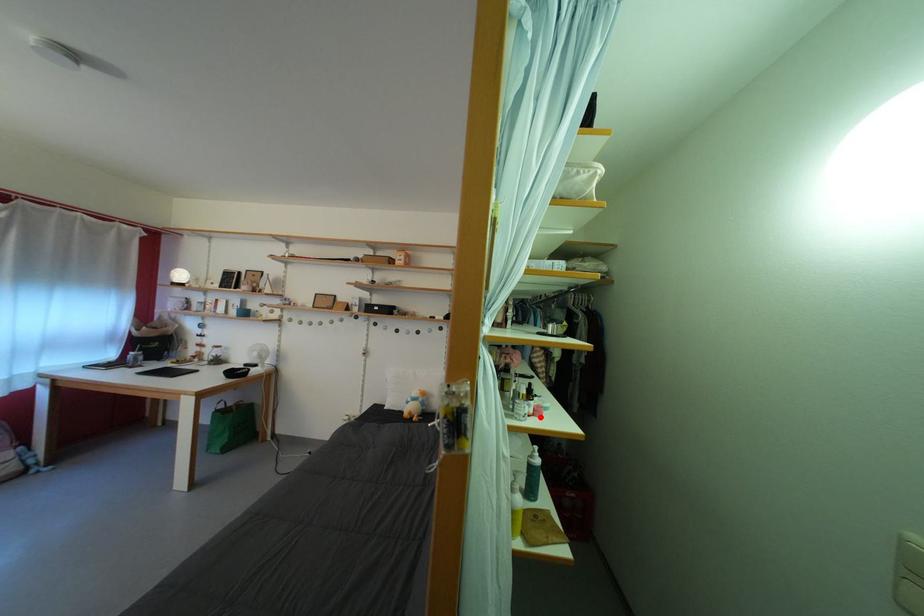
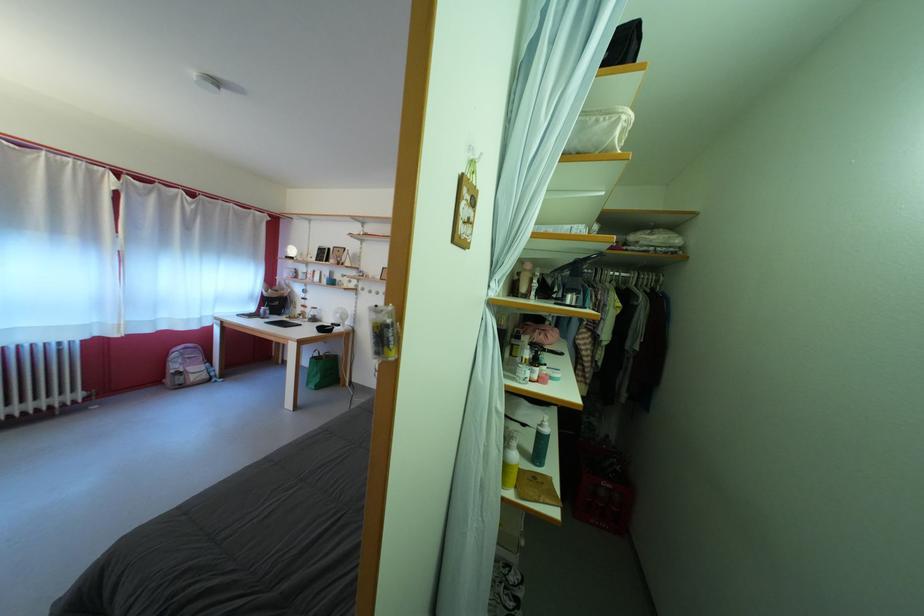
In the second image, find the point that corresponds to the highlighted location in the first image.

(543, 383)